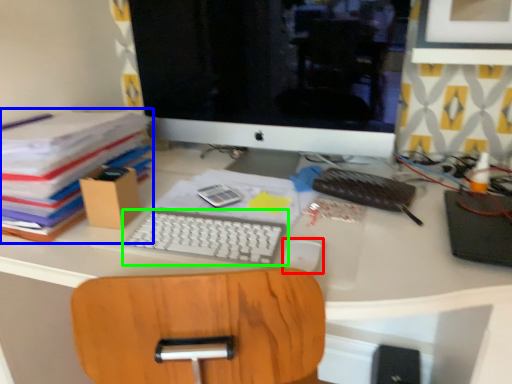
Question: Estimate the real-world distances between objects in this image. Which object is closer to mouse (highlighted by a red box), paperback book (highlighted by a blue box) or computer keyboard (highlighted by a green box)?

Choices:
 (A) paperback book
 (B) computer keyboard

Answer: (B)